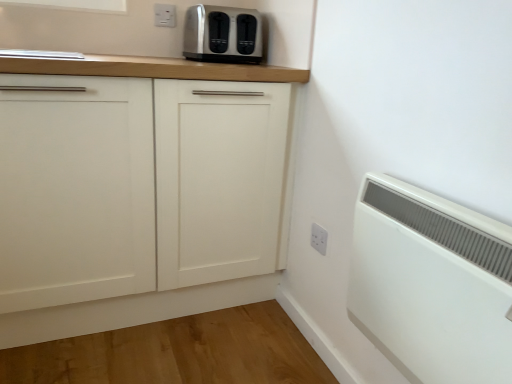
Question: Does point (321, 236) appear closer or farther from the camera than point (382, 198)?

Choices:
 (A) farther
 (B) closer

Answer: (A)

Question: Do you think white plastic electric outlet at center, acting as the 2th electric outlet starting from the left, is within white plastic radiator at lower right, or outside of it?

Choices:
 (A) inside
 (B) outside

Answer: (B)

Question: Estimate the real-world distances between objects in this image. Which object is closer to the white plastic electric outlet at upper center, the second electric outlet when ordered from bottom to top?

Choices:
 (A) white plastic radiator at lower right
 (B) white matte cabinet at center
 (C) satin silver toaster at upper center
 (D) white plastic electric outlet at center, acting as the 2th electric outlet starting from the left

Answer: (C)

Question: Estimate the real-world distances between objects in this image. Which object is closer to the white plastic electric outlet at center, the second electric outlet positioned from the back?

Choices:
 (A) white matte cabinet at center
 (B) white plastic radiator at lower right
 (C) white plastic electric outlet at upper center, arranged as the first electric outlet when viewed from the back
 (D) satin silver toaster at upper center

Answer: (B)